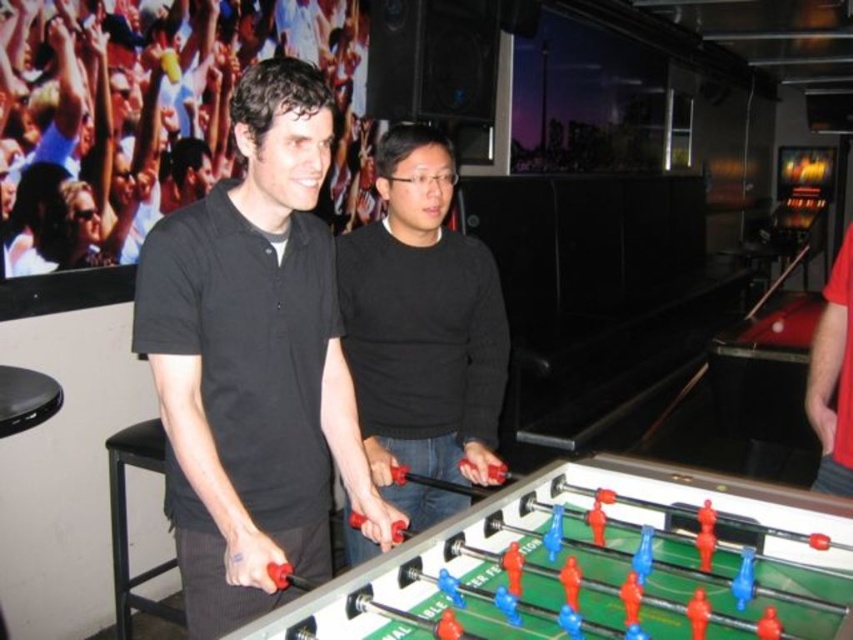
Question: Can you confirm if black matte sweater at center is smaller than red fabric sleeve at right?

Choices:
 (A) yes
 (B) no

Answer: (B)

Question: Which object appears farthest from the camera in this image?

Choices:
 (A) red fabric sleeve at right
 (B) black matte shirt at upper left
 (C) black matte sweater at center
 (D) black matte shirt at left

Answer: (B)

Question: Estimate the real-world distances between objects in this image. Which object is farther from the black matte shirt at upper left?

Choices:
 (A) black matte shirt at left
 (B) red fabric sleeve at right
 (C) black matte sweater at center

Answer: (B)

Question: Which point is farther to the camera?

Choices:
 (A) (38, 147)
 (B) (194, 605)
 (C) (457, 240)
 (D) (828, 476)

Answer: (A)

Question: Does black matte sweater at center appear on the left side of red fabric sleeve at right?

Choices:
 (A) no
 (B) yes

Answer: (B)

Question: Can you confirm if black matte shirt at left is wider than red fabric sleeve at right?

Choices:
 (A) no
 (B) yes

Answer: (B)